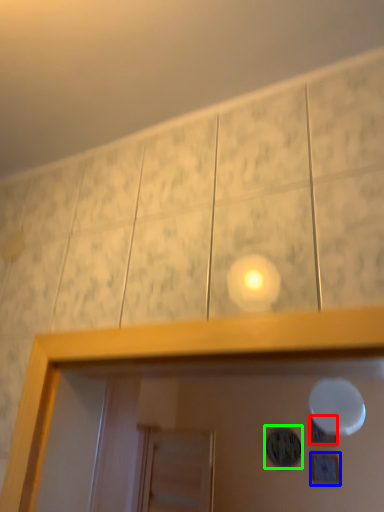
Question: Which is farther away from dot (highlighted by a red box)? picture frame (highlighted by a blue box) or dot (highlighted by a green box)?

Choices:
 (A) picture frame
 (B) dot

Answer: (B)